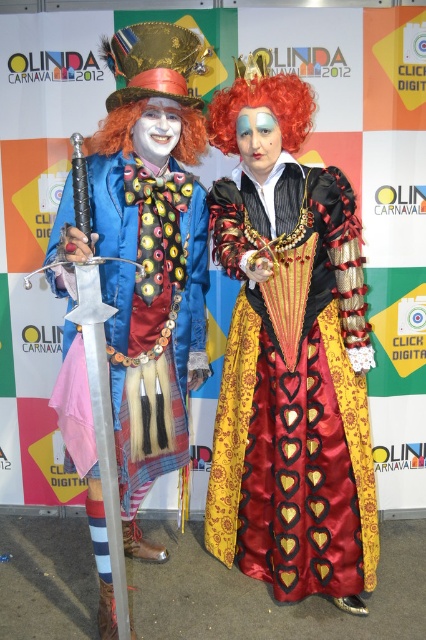
Does silky satin dress at center have a smaller size compared to orange synthetic wig at center?

Incorrect, silky satin dress at center is not smaller in size than orange synthetic wig at center.

Who is taller, silky satin dress at center or orange synthetic wig at center?

Standing taller between the two is silky satin dress at center.

Where is `silky satin dress at center`? silky satin dress at center is located at coordinates (293, 390).

Find the location of a particular element. The width and height of the screenshot is (426, 640). silky satin dress at center is located at coordinates (293, 390).

Can you confirm if shiny blue fabric coat at center is smaller than red curly wig at upper right?

Incorrect, shiny blue fabric coat at center is not smaller in size than red curly wig at upper right.

This screenshot has height=640, width=426. In order to click on shiny blue fabric coat at center in this screenshot , I will do `click(192, 291)`.

Is silver metallic sword at center positioned at the back of orange synthetic wig at center?

No.

Does silver metallic sword at center have a greater width compared to orange synthetic wig at center?

In fact, silver metallic sword at center might be narrower than orange synthetic wig at center.

Identify the location of silver metallic sword at center. (101, 429).